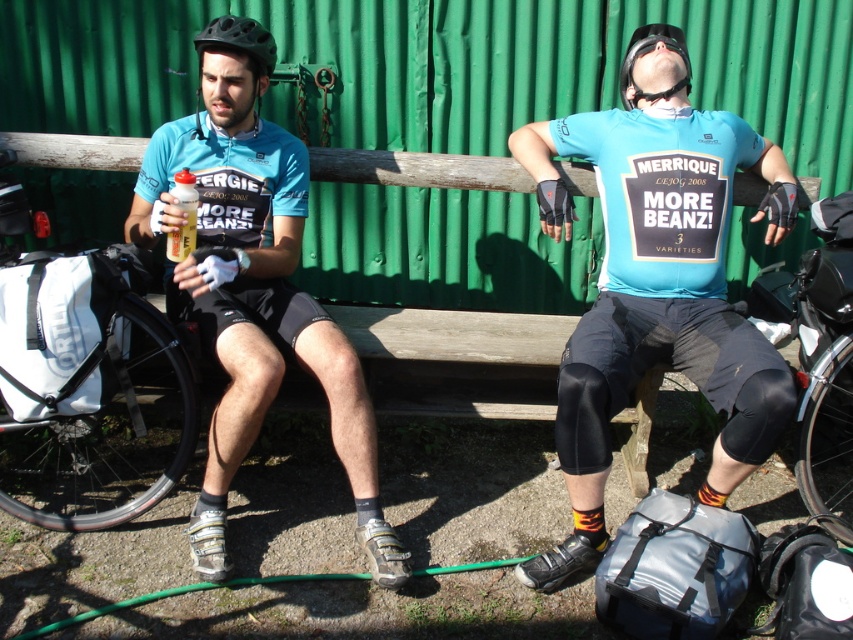
Question: Does matte blue jersey at center appear on the left side of black matte helmet at upper left?

Choices:
 (A) no
 (B) yes

Answer: (A)

Question: Can you confirm if matte blue jersey at center is positioned below black matte bicycle helmet at upper center?

Choices:
 (A) yes
 (B) no

Answer: (A)

Question: Which object is closer to the camera taking this photo?

Choices:
 (A) white fabric bag at left
 (B) matte blue jersey at center
 (C) black matte bicycle helmet at upper center
 (D) black matte helmet at upper left

Answer: (A)

Question: Among these points, which one is nearest to the camera?

Choices:
 (A) (341, 392)
 (B) (674, 355)
 (C) (236, 33)

Answer: (A)

Question: Can you confirm if matte blue jersey at left is bigger than black matte helmet at upper left?

Choices:
 (A) no
 (B) yes

Answer: (B)

Question: Considering the real-world distances, which object is farthest from the matte blue jersey at center?

Choices:
 (A) matte blue jersey at left
 (B) matte black helmet at left

Answer: (B)